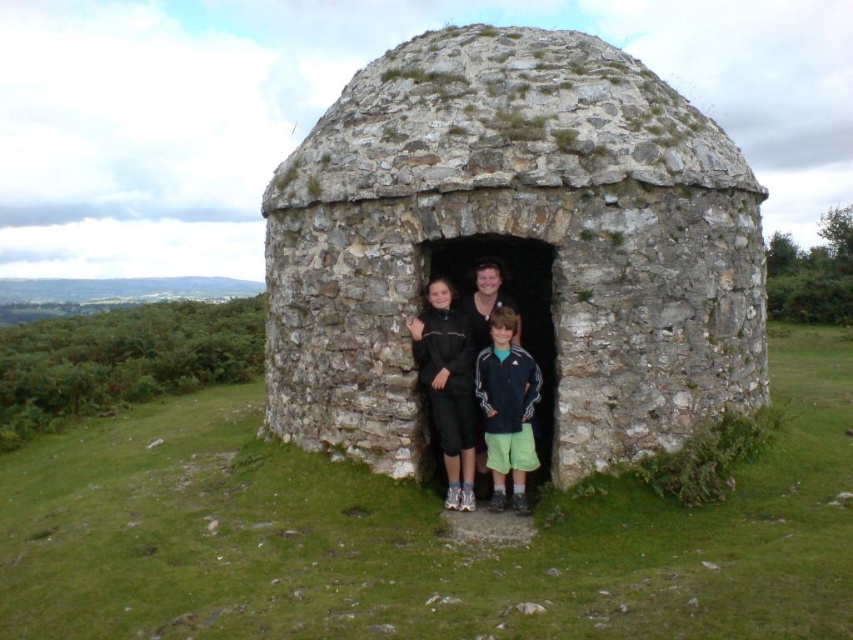
Is rough stone dome at center to the left of dark blue adidas jacket at center from the viewer's perspective?

In fact, rough stone dome at center is to the right of dark blue adidas jacket at center.

What do you see at coordinates (515, 248) in the screenshot?
I see `rough stone dome at center` at bounding box center [515, 248].

Identify the location of rough stone dome at center. The width and height of the screenshot is (853, 640). (515, 248).

Can you confirm if dark blue adidas jacket at center is positioned to the left of matte black jacket at center?

No, dark blue adidas jacket at center is not to the left of matte black jacket at center.

Is the position of dark blue adidas jacket at center more distant than that of matte black jacket at center?

No, dark blue adidas jacket at center is in front of matte black jacket at center.

Measure the distance between point [521,410] and camera.

A distance of 7.33 meters exists between point [521,410] and camera.

At what (x,y) coordinates should I click in order to perform the action: click on dark blue adidas jacket at center. Please return your answer as a coordinate pair (x, y). Looking at the image, I should click on (508, 406).

Who is positioned more to the left, rough stone dome at center or matte black jacket at center?

matte black jacket at center is more to the left.

Can you confirm if rough stone dome at center is positioned below matte black jacket at center?

Incorrect, rough stone dome at center is not positioned below matte black jacket at center.

What do you see at coordinates (515, 248) in the screenshot? I see `rough stone dome at center` at bounding box center [515, 248].

You are a GUI agent. You are given a task and a screenshot of the screen. Output one action in this format:
    pyautogui.click(x=<x>, y=<y>)
    Task: Click on the rough stone dome at center
    The width and height of the screenshot is (853, 640).
    Given the screenshot: What is the action you would take?
    pyautogui.click(x=515, y=248)